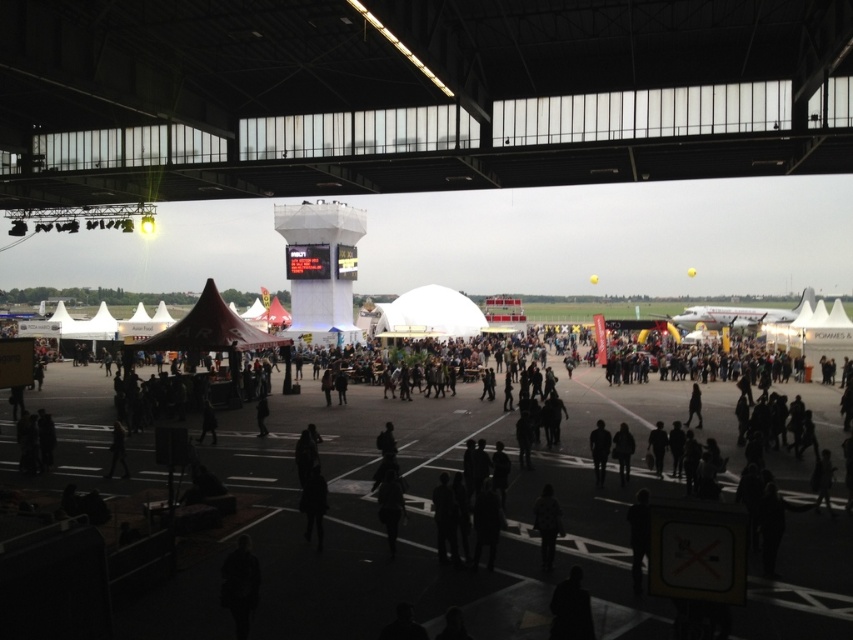
Question: Which point is closer to the camera taking this photo?

Choices:
 (A) tap(606, 452)
 (B) tap(560, 529)
 (C) tap(799, 552)

Answer: (B)

Question: Can you confirm if white plastic control tower at center is positioned to the left of dark gray fabric jacket at lower center?

Choices:
 (A) yes
 (B) no

Answer: (A)

Question: Can you confirm if dark asphalt tarmac at center is positioned to the right of dark fabric jacket at center?

Choices:
 (A) yes
 (B) no

Answer: (B)

Question: Which object appears closest to the camera in this image?

Choices:
 (A) dark gray fabric jacket at lower center
 (B) white plastic control tower at center
 (C) dark fabric jacket at center

Answer: (A)

Question: Among these points, which one is farthest from the camera?

Choices:
 (A) pos(537,515)
 (B) pos(320,278)

Answer: (B)

Question: Is dark gray fabric jacket at lower center to the right of dark fabric jacket at center from the viewer's perspective?

Choices:
 (A) yes
 (B) no

Answer: (B)